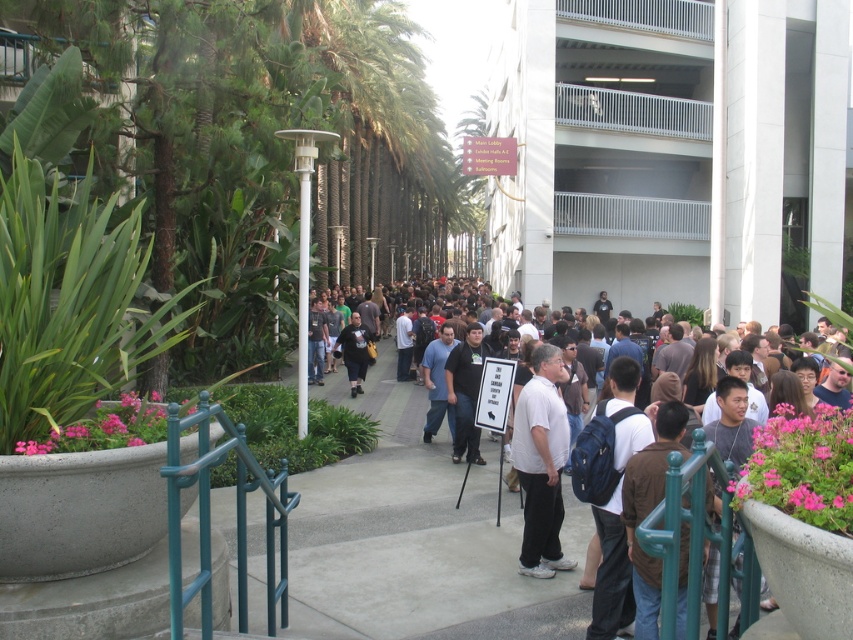
Question: Which of these objects is positioned closest to the matte blue backpack at lower right?

Choices:
 (A) matte blue shirt at center
 (B) white matte shirt at center

Answer: (B)

Question: In this image, where is pink floral arrangement at lower right located relative to white matte shirt at center?

Choices:
 (A) above
 (B) below

Answer: (A)

Question: Based on their relative distances, which object is nearer to the brown fabric shirt at center-right?

Choices:
 (A) pink floral arrangement at lower right
 (B) black t-shirt at center
 (C) matte blue shirt at center

Answer: (A)

Question: Does brown fabric shirt at center-right appear under matte blue backpack at lower right?

Choices:
 (A) yes
 (B) no

Answer: (B)

Question: Is dark gray shirt at center bigger than pink floral arrangement at lower right?

Choices:
 (A) no
 (B) yes

Answer: (B)

Question: Which point appears farthest from the camera in this image?

Choices:
 (A) (624, 481)
 (B) (379, 451)
 (C) (355, 355)
 (D) (827, 444)

Answer: (C)